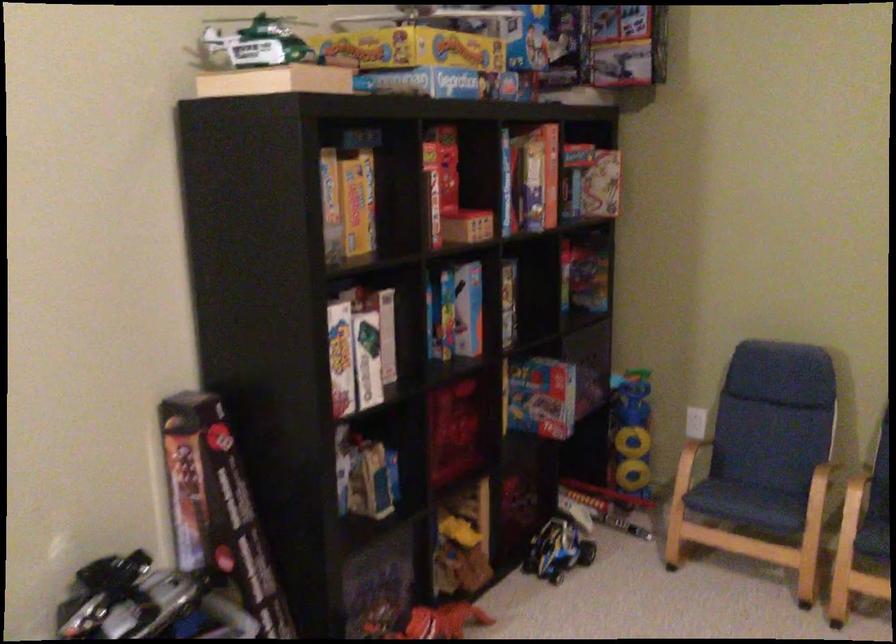
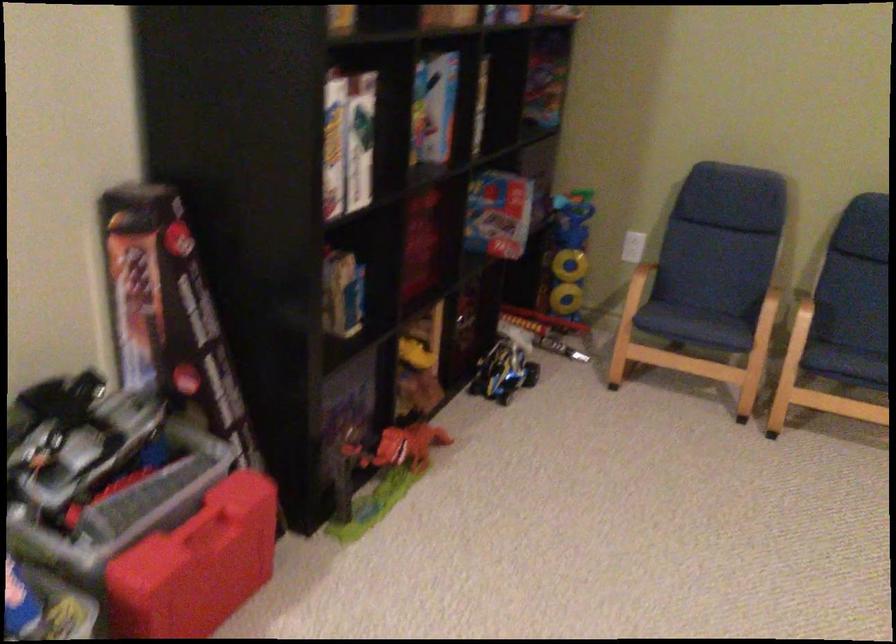
The images are taken continuously from a first-person perspective. In which direction are you moving?

The cameraman moved toward left, forward.